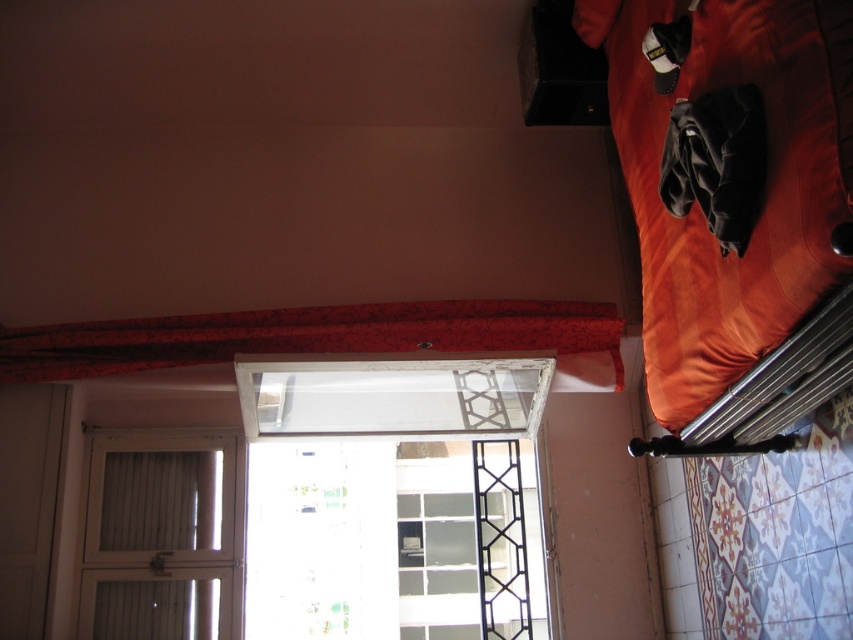
Question: Is orange leather bed at right above white wood glass door at lower left?

Choices:
 (A) yes
 (B) no

Answer: (A)

Question: Which of the following is the farthest from the observer?

Choices:
 (A) (697, 308)
 (B) (129, 636)
 (C) (300, 484)

Answer: (C)

Question: Is orange leather bed at right wider than clear glass window at center?

Choices:
 (A) no
 (B) yes

Answer: (A)

Question: Which is farther from the white wood glass door at lower left?

Choices:
 (A) clear glass window at center
 (B) orange leather bed at right
 (C) red floral fabric curtain at upper center

Answer: (B)

Question: Which point is farther to the camera?

Choices:
 (A) (165, 438)
 (B) (396, 385)

Answer: (A)

Question: From the image, what is the correct spatial relationship of clear glass window at center in relation to red floral fabric curtain at upper center?

Choices:
 (A) left
 (B) right

Answer: (B)